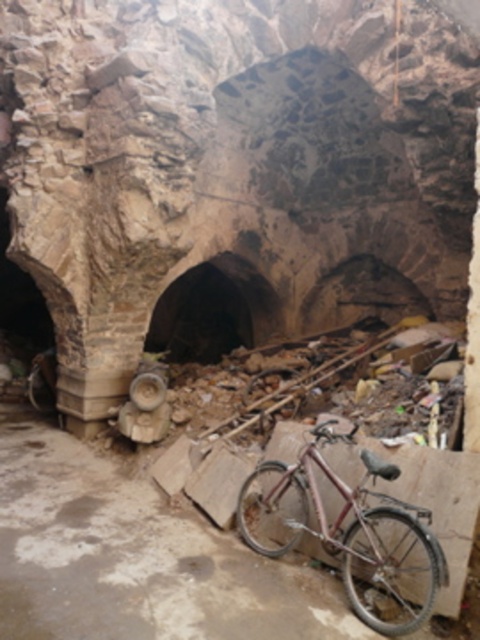
You are a delivery person who needs to move a large box through the brown stone tunnel at center. The rusty metal bicycle at center is blocking the entrance. Can you move the bicycle to clear the path?

The rusty metal bicycle at center is positioned under the brown stone tunnel at center, so moving it would clear the entrance for the large box.

You are a tour guide leading a group through this historical site. You notice the rusty metal bicycle at center and the brown stone tunnel at center. Which object is wider? Please explain your reasoning based on the scene.

The rusty metal bicycle at center is wider than the brown stone tunnel at center according to the description provided.